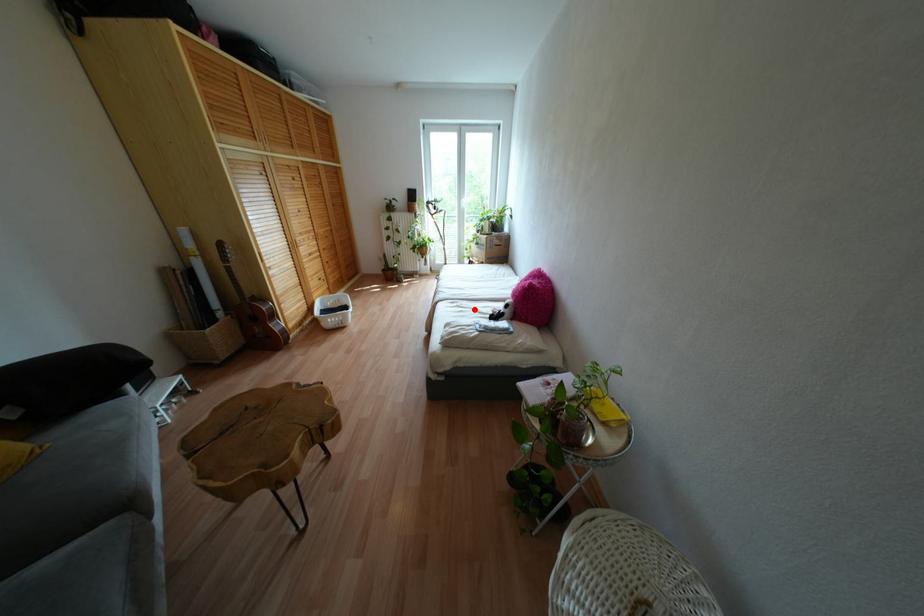
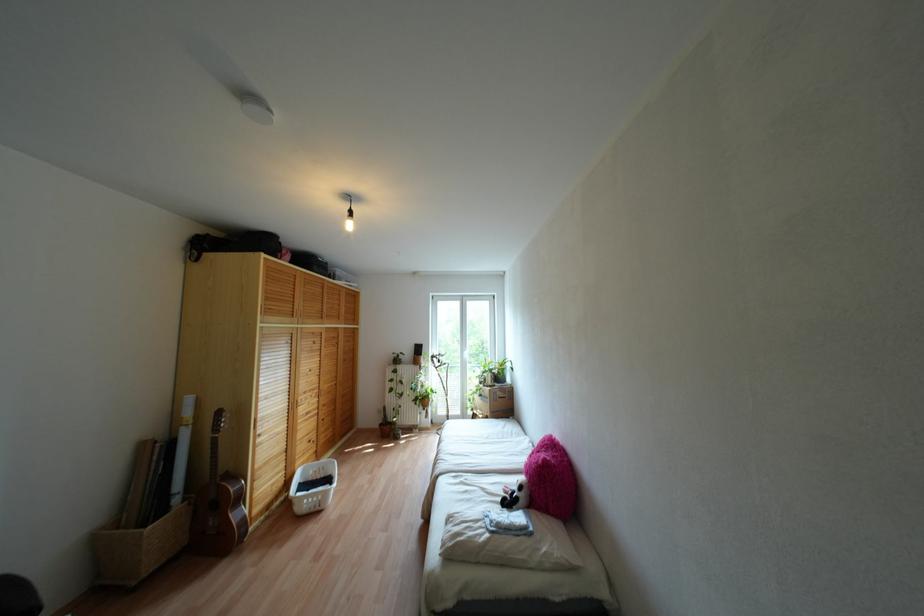
Find the pixel in the second image that matches the highlighted location in the first image.

(482, 488)